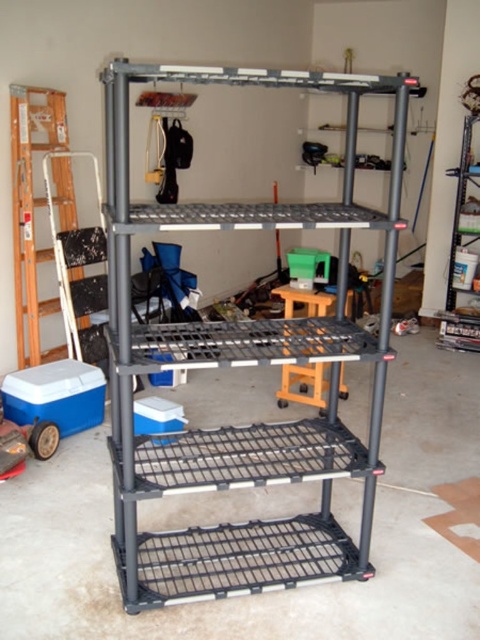
You are moving a 1.5 meter wide box into the garage. There is a wooden ladder at left and a wooden stool at center. Can you move the box through the space between them?

The wooden ladder at left is 1.80 meters from the wooden stool at center. Since the box is 1.5 meters wide, it can fit through the space between them as the distance is greater than the box width.

You are organizing tools in a garage and need to move a heavy box from the wooden ladder at left to the wooden stool at center. Which object should you move first to create space?

You should move the wooden ladder at left first because it is in front of the wooden stool at center, so moving it will allow access to the stool and create space.